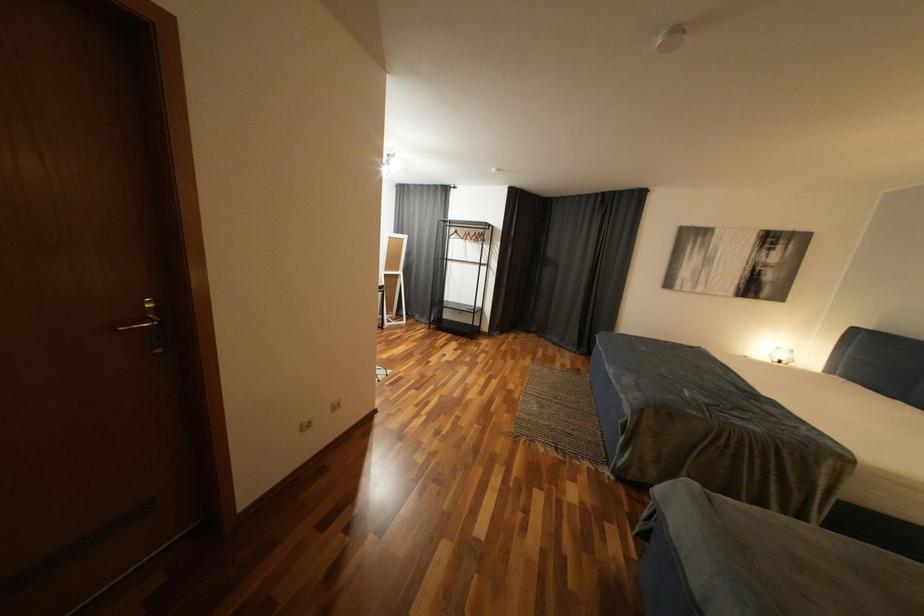
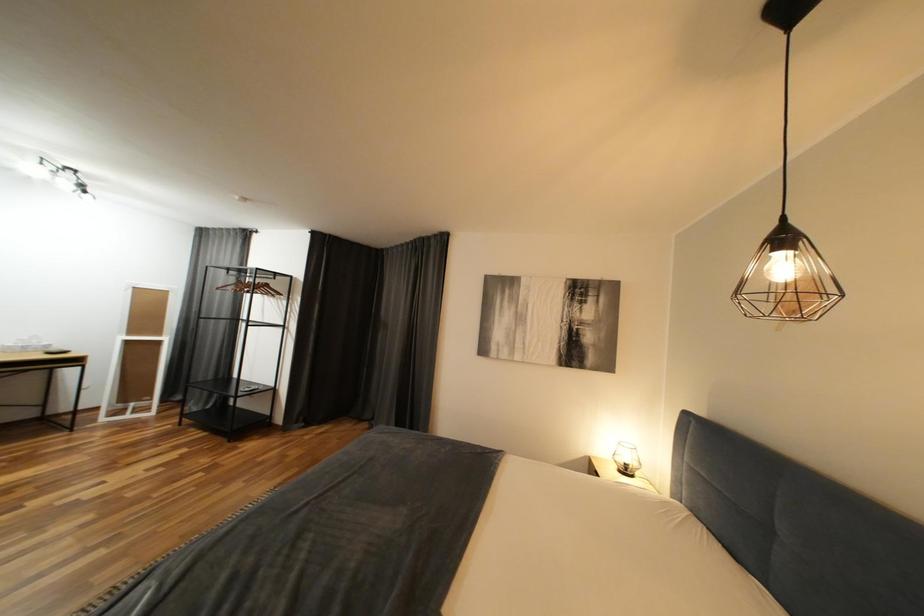
The images are taken continuously from a first-person perspective. In which direction are you moving?

The cameraman walked toward right, forward.